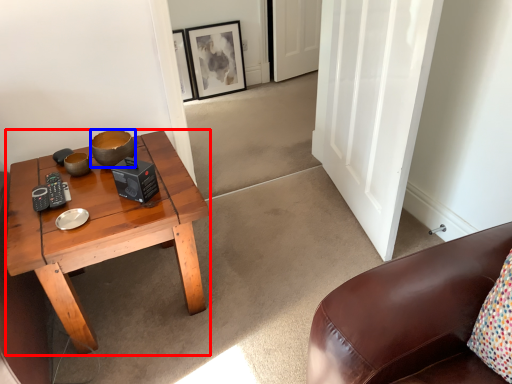
Question: Which of the following is the farthest to the observer, coffee table (highlighted by a red box) or bowl (highlighted by a blue box)?

Choices:
 (A) coffee table
 (B) bowl

Answer: (B)